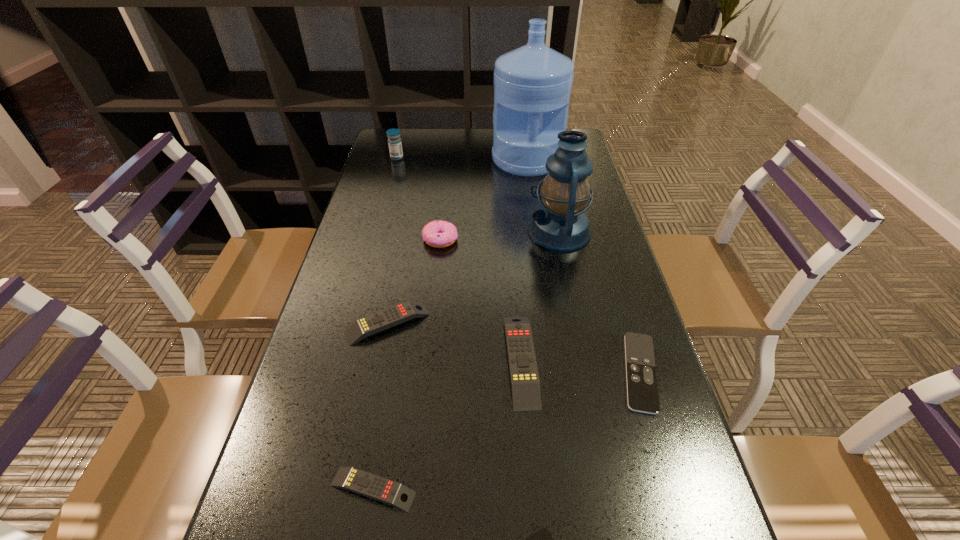
Where is `vacant space in between the smallest yellow remote control and the lantern`? vacant space in between the smallest yellow remote control and the lantern is located at coordinates (467, 361).

Identify the location of vacant space in between the fourth shortest remote control and the medicine. The image size is (960, 540). (393, 240).

This screenshot has height=540, width=960. I want to click on free space that is in between the tallest remote control and the tallest object, so click(524, 260).

You are a GUI agent. You are given a task and a screenshot of the screen. Output one action in this format:
    pyautogui.click(x=<x>, y=<y>)
    Task: Click on the free space between the blue lantern and the second nearest object
    The image size is (960, 540).
    Given the screenshot: What is the action you would take?
    (x=467, y=361)

Locate an element on the screen. Image resolution: width=960 pixels, height=540 pixels. free area in between the farther black remote control and the nearest yellow remote control is located at coordinates (507, 430).

At what (x,y) coordinates should I click in order to perform the action: click on free space between the smallest yellow remote control and the fifth shortest object. Please return your answer as a coordinate pair (x, y). Looking at the image, I should click on [446, 424].

Select which object appears as the fifth closest to the doughnut. Please provide its 2D coordinates. Your answer should be formatted as a tuple, i.e. [(x, y)], where the tuple contains the x and y coordinates of a point satisfying the conditions above.

[(394, 141)]

Identify which object is the second closest to the blue medicine. Please provide its 2D coordinates. Your answer should be formatted as a tuple, i.e. [(x, y)], where the tuple contains the x and y coordinates of a point satisfying the conditions above.

[(439, 234)]

At what (x,y) coordinates should I click in order to perform the action: click on remote control that is the fourth nearest to the medicine. Please return your answer as a coordinate pair (x, y). The width and height of the screenshot is (960, 540). Looking at the image, I should click on point(363,483).

Select which remote control is the third closest to the right black remote control. Please provide its 2D coordinates. Your answer should be formatted as a tuple, i.e. [(x, y)], where the tuple contains the x and y coordinates of a point satisfying the conditions above.

[(377, 322)]